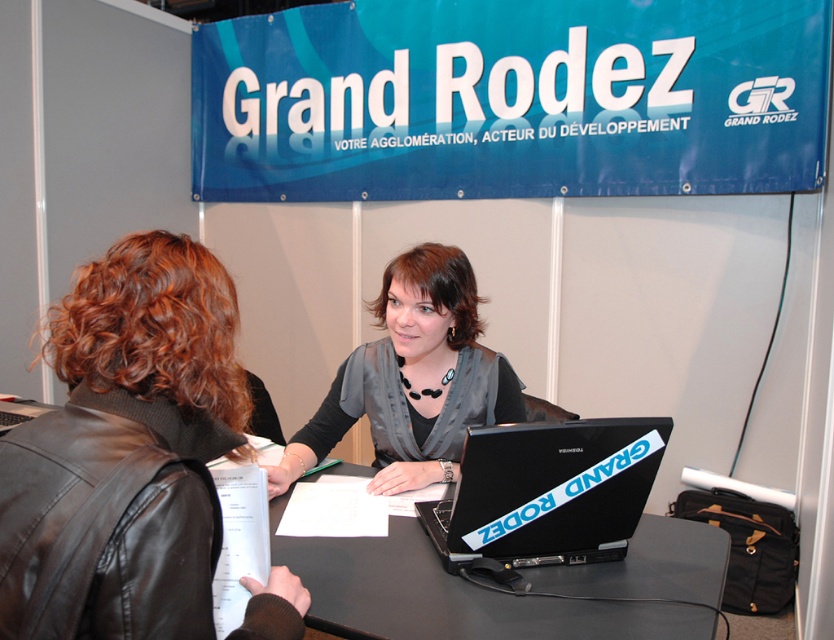
You are attending the Grand Rodez event and notice the black matte table at center and the matte gray blouse at center. From your perspective, which object is located to the left?

The matte gray blouse at center is located to the left of the black matte table at center.

You are attending the Grand Rodez event and notice two attendees wearing a black leather jacket at upper left and a matte gray blouse at center. Which clothing item is shorter in length?

The black leather jacket at upper left is shorter than the matte gray blouse at center.

You are attending the Grand Rodez event and notice the black matte table at center and the matte gray blouse at center. From your perspective, which object is positioned lower in the image?

The black matte table at center is located below the matte gray blouse at center, so it is positioned lower in the image.